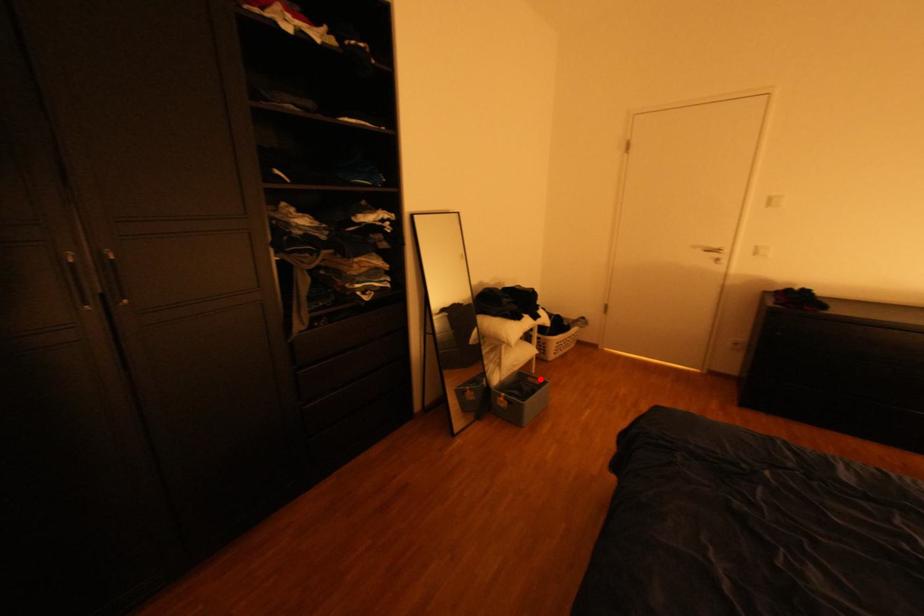
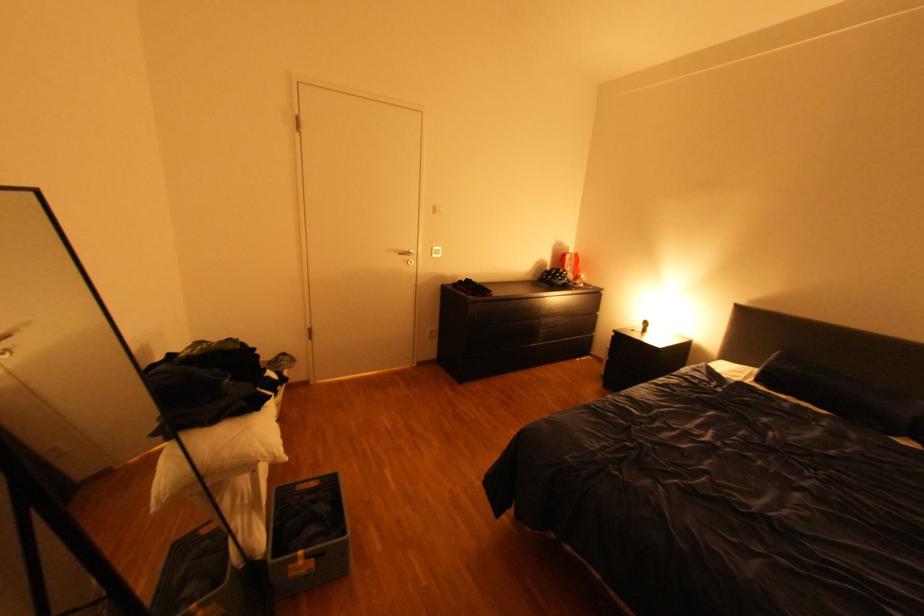
Find the pixel in the second image that matches the highlighted location in the first image.

(310, 488)